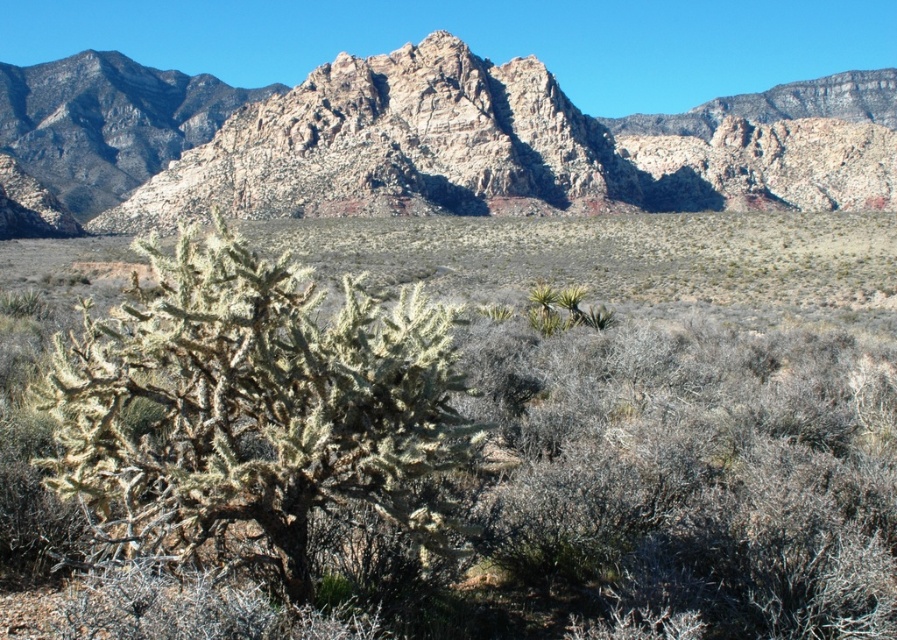
You are a hiker planning to take a photo of the rugged rock mountain range at upper center and the green spiny bush at center. Which object should you focus on first if you want to capture both in a single frame without adjusting your camera settings?

The rugged rock mountain range at upper center is taller than the green spiny bush at center, so you should focus on the rugged rock mountain range at upper center first to ensure both are in focus.

You are a hiker trying to navigate through the desert. You see the rugged rock mountain range at upper center and the green spiny bush at center. Which object is higher in elevation?

The rugged rock mountain range at upper center is positioned over the green spiny bush at center, meaning it has a higher elevation.

You are a hiker standing at the base of the rugged rock mountain range at upper center. You want to reach the summit. Given that the mountain is 169.76 meters tall, do you think you can climb it in one day?

The rugged rock mountain range at upper center is 169.76 meters from viewer. While the height is significant, many hikers can climb mountains of this height in a day depending on their fitness level and the path. However, it is important to check the trail conditions and weather before attempting the climb.